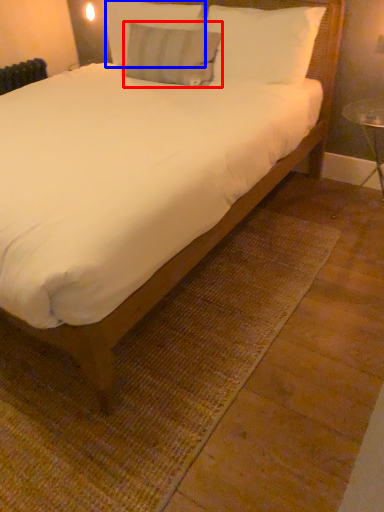
Question: Which of the following is the closest to the observer, pillow (highlighted by a red box) or pillow (highlighted by a blue box)?

Choices:
 (A) pillow
 (B) pillow

Answer: (A)